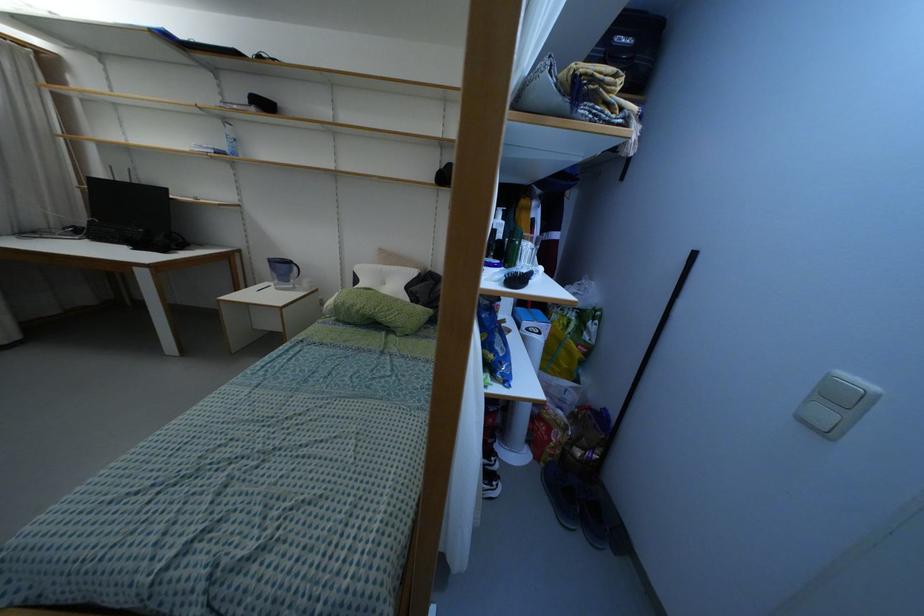
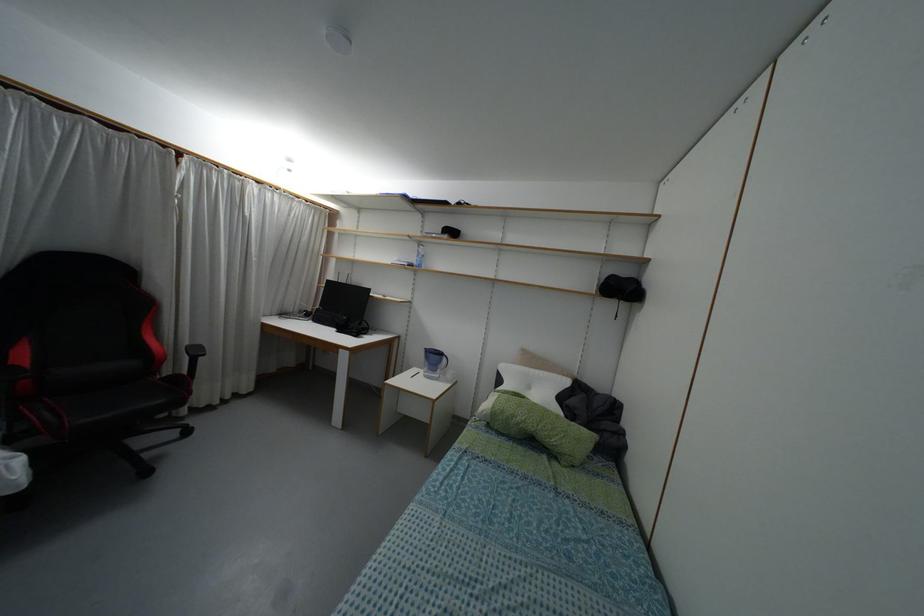
The images are taken continuously from a first-person perspective. In which direction is your viewpoint rotating?

The camera rotated toward left-up.